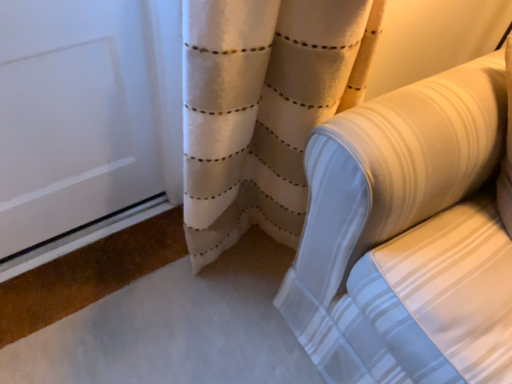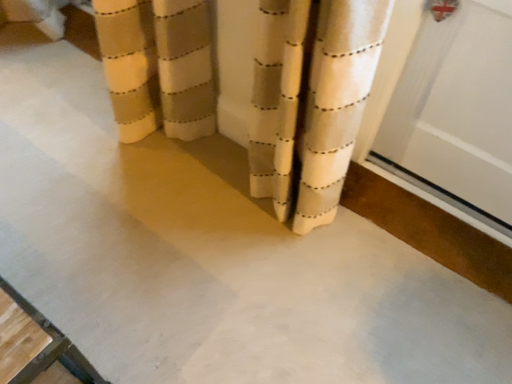
Question: How did the camera likely rotate when shooting the video?

Choices:
 (A) rotated right
 (B) rotated left

Answer: (B)